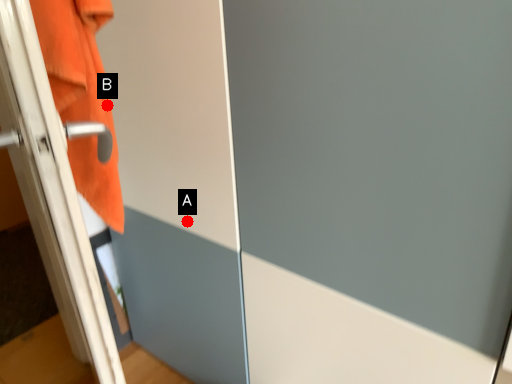
Question: Two points are circled on the image, labeled by A and B beside each circle. Which point appears closest to the camera in this image?

Choices:
 (A) A is closer
 (B) B is closer

Answer: (B)